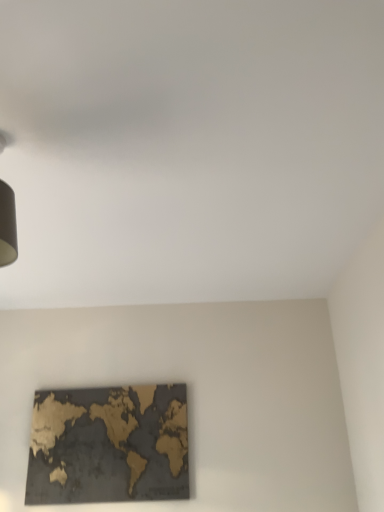
Find the location of a particular element. gold textured map at lower center is located at coordinates (108, 445).

What do you see at coordinates (108, 445) in the screenshot?
I see `gold textured map at lower center` at bounding box center [108, 445].

Locate an element on the screen. Image resolution: width=384 pixels, height=512 pixels. gold textured map at lower center is located at coordinates (108, 445).